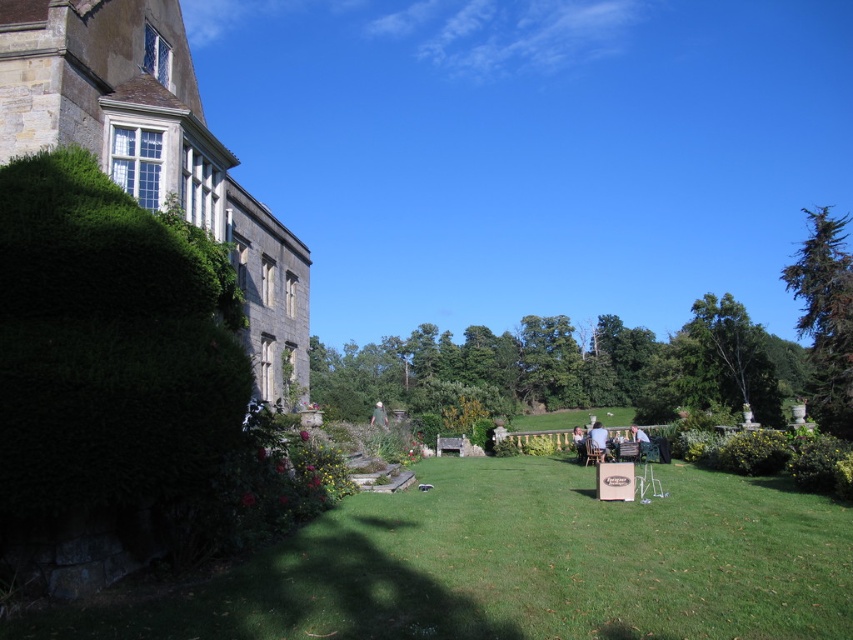
Question: Does light blue fabric chair at center have a lesser width compared to green fabric chair at lower right?

Choices:
 (A) no
 (B) yes

Answer: (B)

Question: Can you confirm if light blue fabric chair at center is smaller than green fabric chair at lower right?

Choices:
 (A) yes
 (B) no

Answer: (A)

Question: Which object is closer to the camera taking this photo?

Choices:
 (A) light blue fabric chair at center
 (B) green fabric chair at lower right

Answer: (B)

Question: Which point is closer to the camera taking this photo?

Choices:
 (A) (640, 452)
 (B) (598, 440)

Answer: (B)

Question: Can you confirm if light blue fabric chair at center is positioned to the left of green fabric chair at lower right?

Choices:
 (A) yes
 (B) no

Answer: (A)